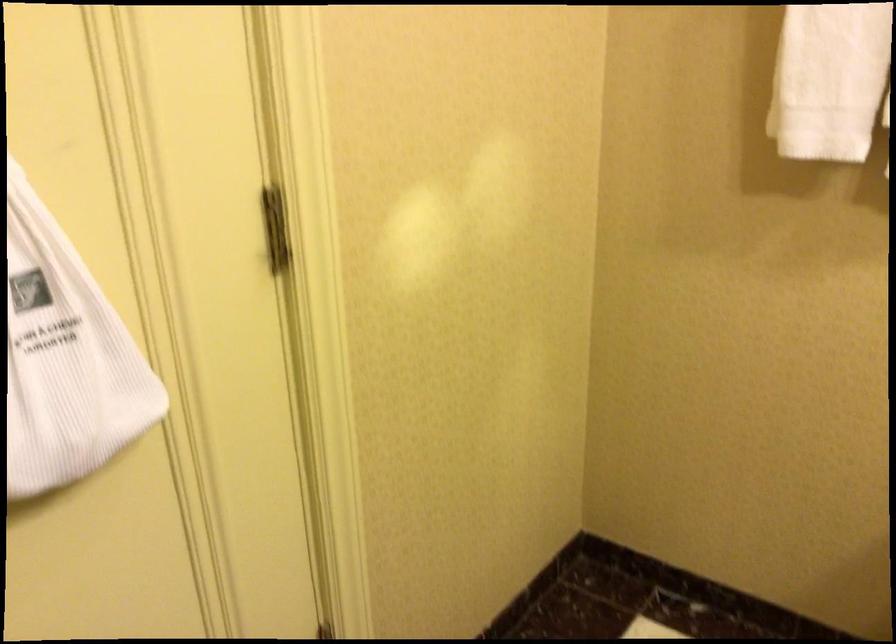
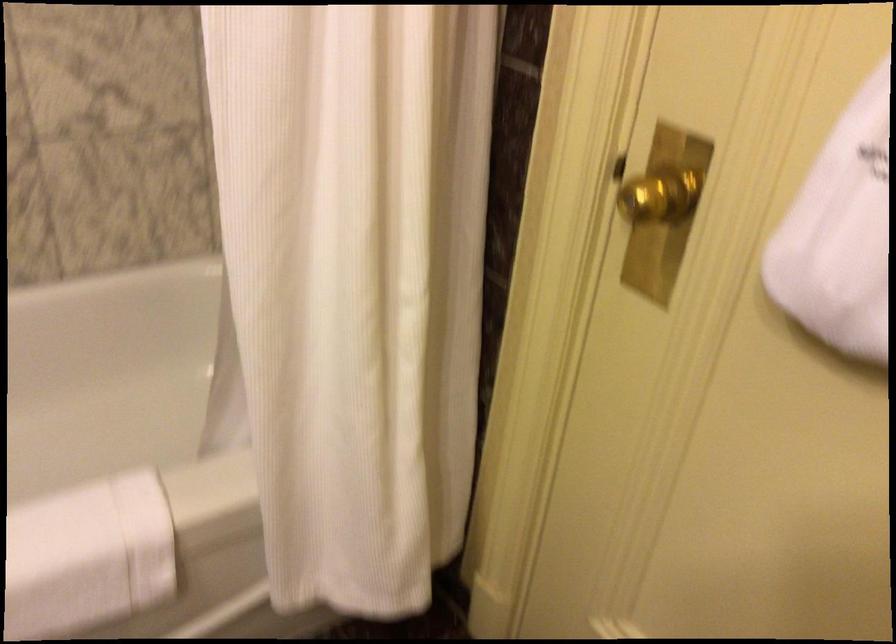
How did the camera likely rotate?

The camera rotated toward left-down.